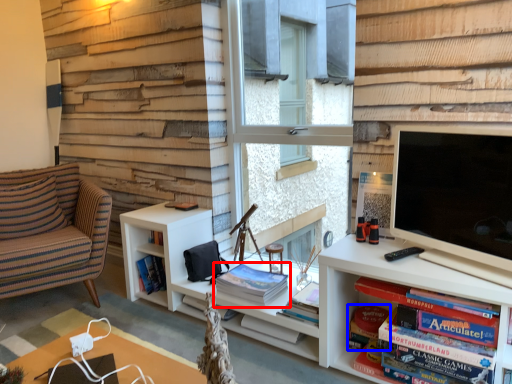
Question: Which object is further to the camera taking this photo, book (highlighted by a red box) or paperback book (highlighted by a blue box)?

Choices:
 (A) book
 (B) paperback book

Answer: (A)